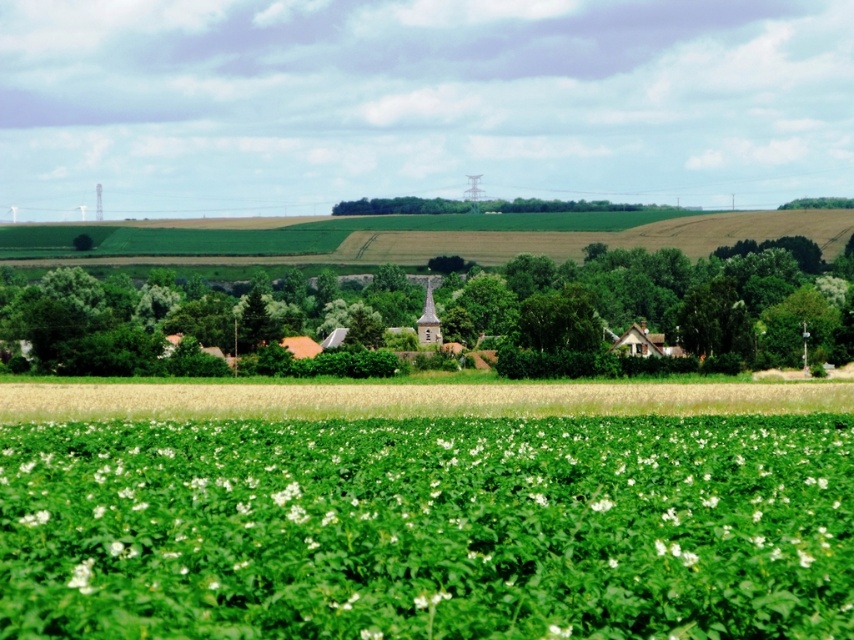
Who is shorter, green leafy tree at center or green grassy field at center?

Standing shorter between the two is green grassy field at center.

Is green leafy tree at center thinner than green grassy field at center?

No, green leafy tree at center is not thinner than green grassy field at center.

Image resolution: width=854 pixels, height=640 pixels. What are the coordinates of `green leafy tree at center` in the screenshot? It's located at click(x=654, y=307).

You are a GUI agent. You are given a task and a screenshot of the screen. Output one action in this format:
    pyautogui.click(x=<x>, y=<y>)
    Task: Click on the green leafy tree at center
    This screenshot has width=854, height=640.
    Given the screenshot: What is the action you would take?
    pyautogui.click(x=654, y=307)

Is green leafy plant at center above green leafy tree at center?

Incorrect, green leafy plant at center is not positioned above green leafy tree at center.

In the scene shown: Does green leafy plant at center lie in front of green leafy tree at center?

Yes, it is in front of green leafy tree at center.

What are the coordinates of `green leafy plant at center` in the screenshot? It's located at click(x=430, y=528).

Does green leafy plant at center have a lesser height compared to green grassy field at center?

Incorrect, green leafy plant at center's height does not fall short of green grassy field at center's.

Can you confirm if green leafy plant at center is positioned to the right of green grassy field at center?

Indeed, green leafy plant at center is positioned on the right side of green grassy field at center.

Where is `green leafy plant at center`? This screenshot has width=854, height=640. green leafy plant at center is located at coordinates (430, 528).